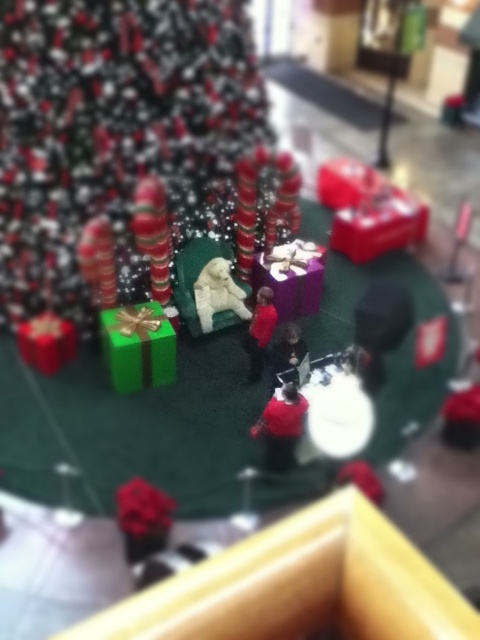
You are organizing a holiday gift exchange and need to place both the green matte gift at center and the shiny metallic candy cane at center on a small table. Based on their sizes, which item should you place first to ensure stability?

The green matte gift at center should be placed first because it is larger and provides a stable base for the smaller shiny metallic candy cane at center.

You are a delivery person who just arrived at the festive indoor setting. You need to place a new gift that is 1 foot tall. The green matte gift at center is currently occupying space. Can the new gift fit under the shiny metallic candy cane at center without exceeding its height?

The green matte gift at center is not as tall as shiny metallic candy cane at center, so the new gift that is 1 foot tall can fit under the shiny metallic candy cane at center since the candy cane is taller than the current gift.

You are a delivery person who just arrived at the festive indoor setting. You need to place a new gift that is 18 inches wide on the green carpeted area. The shiny metallic tree at center and green matte gift at center are already there. Can you fit the new gift between them without moving the existing items?

The shiny metallic tree at center and green matte gift at center are 17.60 inches apart. Since the new gift is 18 inches wide, it cannot fit between them as the space is slightly smaller than the gift.